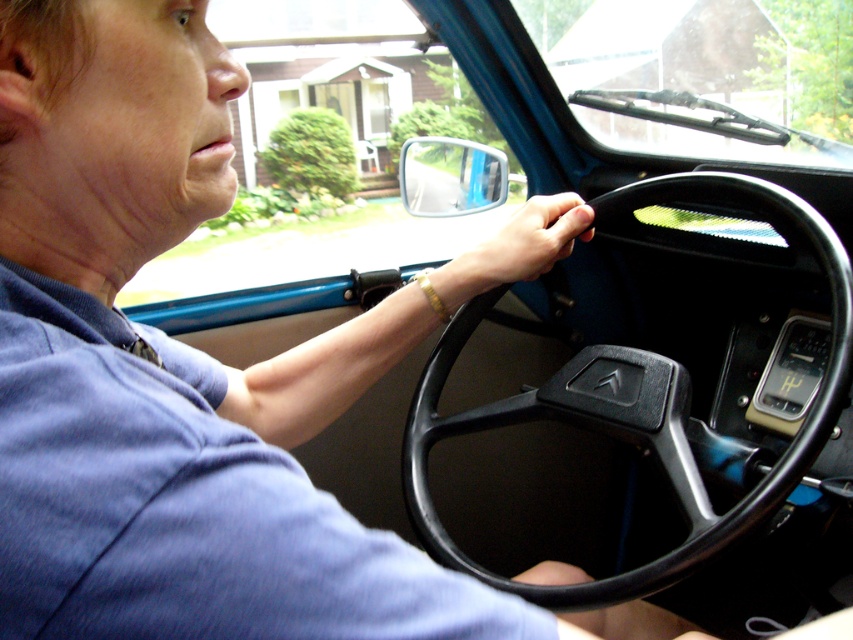
Question: Is black plastic steering wheel at center bigger than gold bracelet at center?

Choices:
 (A) yes
 (B) no

Answer: (A)

Question: Which point is farther to the camera?

Choices:
 (A) (552, 584)
 (B) (421, 384)
 (C) (434, 285)

Answer: (B)

Question: Is the position of blue cotton shirt at center more distant than that of gold bracelet at center?

Choices:
 (A) no
 (B) yes

Answer: (A)

Question: Which point is farther from the camera taking this photo?

Choices:
 (A) (637, 632)
 (B) (57, 413)
 (C) (688, 516)
 (D) (473, 266)

Answer: (D)

Question: Estimate the real-world distances between objects in this image. Which object is farther from the black plastic steering wheel at center?

Choices:
 (A) gold bracelet at center
 (B) black rubber hand at center
 (C) blue cotton shirt at center

Answer: (C)

Question: Is black plastic steering wheel at center wider than black rubber hand at center?

Choices:
 (A) no
 (B) yes

Answer: (B)